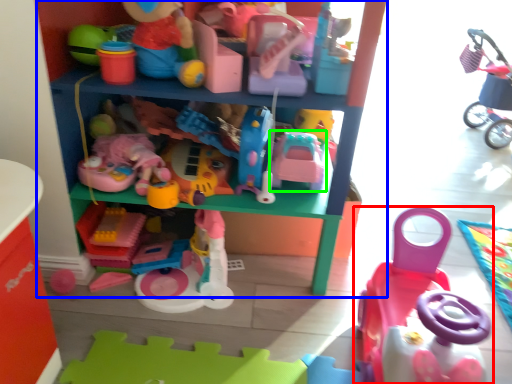
Question: Which is farther away from toy (highlighted by a red box)? shelf (highlighted by a blue box) or toy (highlighted by a green box)?

Choices:
 (A) shelf
 (B) toy

Answer: (A)